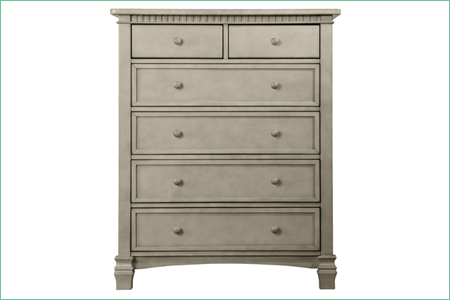
Locate an element on the screen. Image resolution: width=450 pixels, height=300 pixels. top of the dresser is located at coordinates (133, 10), (231, 11), (332, 11).